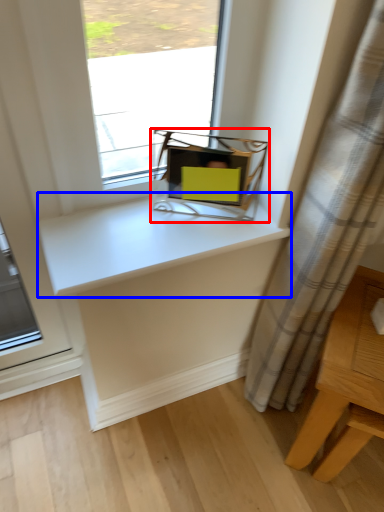
Question: Which of the following is the closest to the observer, equipment (highlighted by a red box) or counter top (highlighted by a blue box)?

Choices:
 (A) equipment
 (B) counter top

Answer: (B)